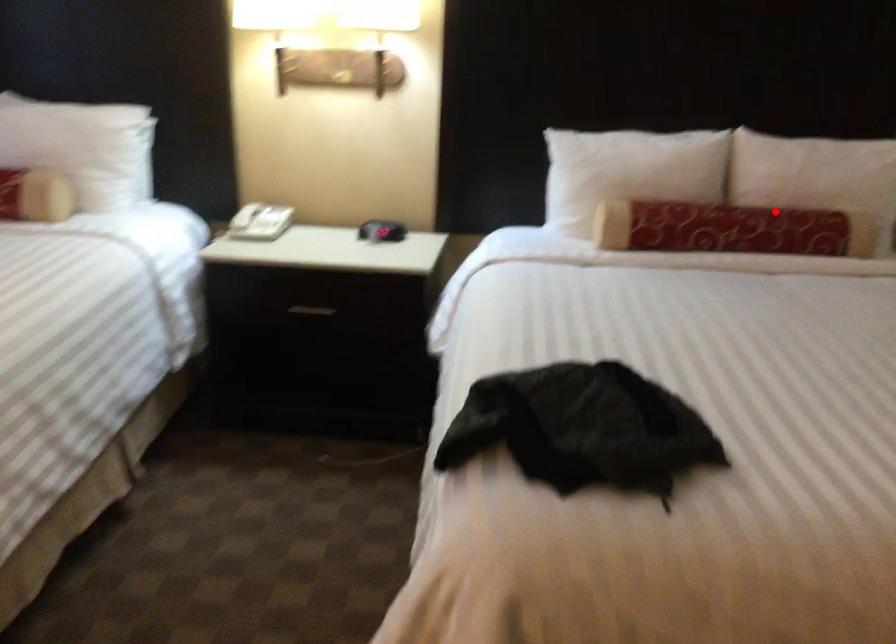
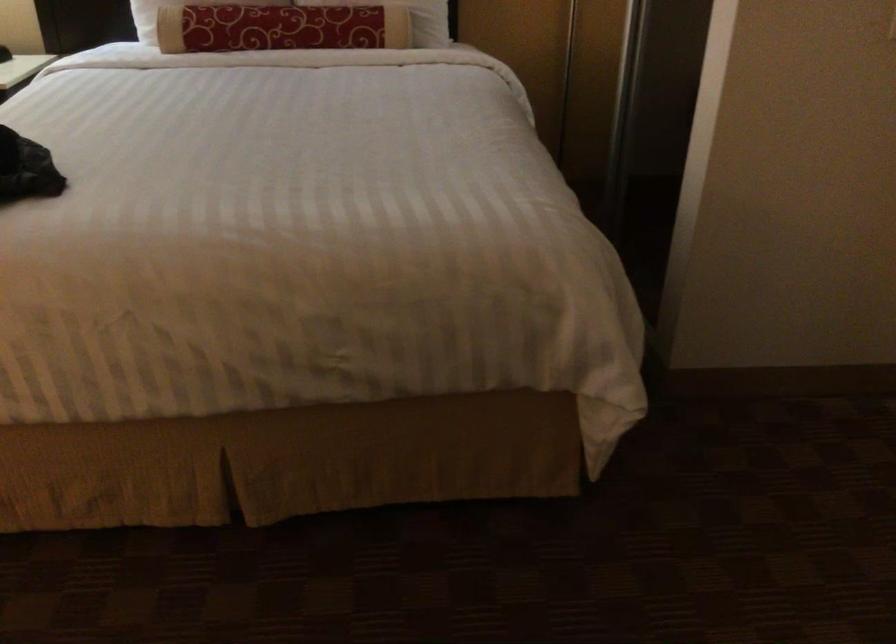
The point at the highlighted location is marked in the first image. Where is the corresponding point in the second image?

(311, 15)